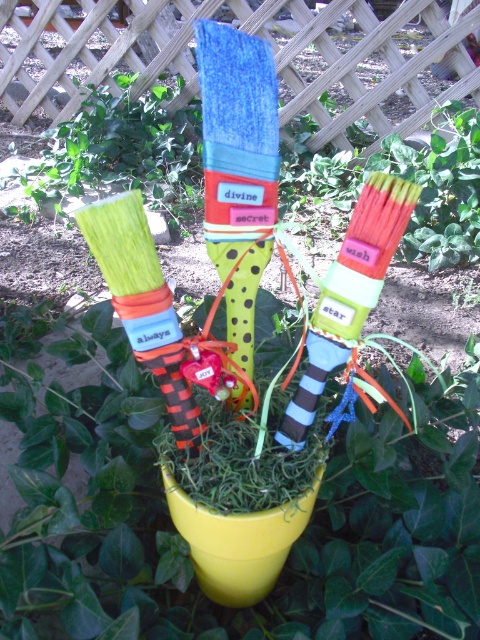
Where is `matte green paintbrush at center`? matte green paintbrush at center is located at coordinates point(186,545).

Can you confirm if matte green paintbrush at center is positioned above green polka dot sock at center?

Actually, matte green paintbrush at center is below green polka dot sock at center.

Is point (48, 420) closer to camera compared to point (247, 68)?

No, it is not.

Where is `matte green paintbrush at center`? matte green paintbrush at center is located at coordinates (186, 545).